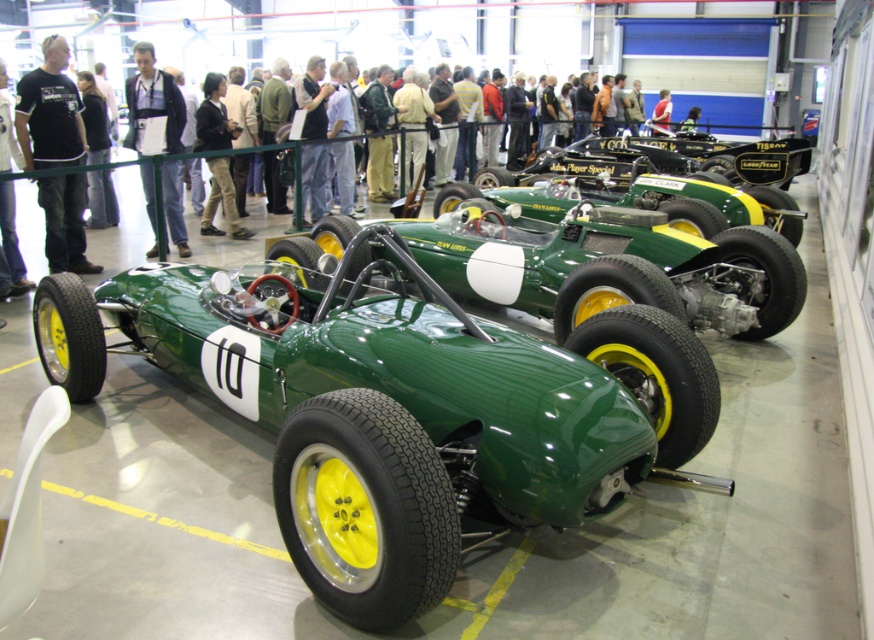
Question: Does black cotton t-shirt at left have a lesser width compared to dark brown leather jacket at center?

Choices:
 (A) yes
 (B) no

Answer: (B)

Question: Can you confirm if green matte sports car at center is bigger than matte black jacket at center?

Choices:
 (A) no
 (B) yes

Answer: (B)

Question: Which of these objects is positioned farthest from the green matte/satin sports car at center?

Choices:
 (A) white leather jacket at left
 (B) matte black jacket at center
 (C) black cotton t-shirt at left

Answer: (B)

Question: Which of the following is the farthest from the observer?

Choices:
 (A) (556, 164)
 (B) (4, 83)
 (C) (639, 452)
 (D) (696, 125)

Answer: (D)

Question: Is the position of green matte sports car at center less distant than that of dark brown leather jacket at center?

Choices:
 (A) no
 (B) yes

Answer: (B)

Question: Which object is farther from the camera taking this photo?

Choices:
 (A) white leather jacket at left
 (B) matte black jacket at center

Answer: (B)